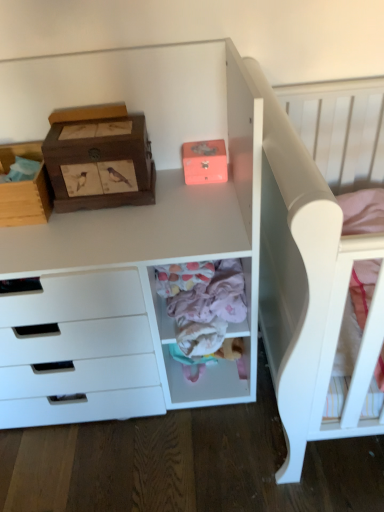
Question: Is wooden cardboard box at left not near pastel pink fabric at center?

Choices:
 (A) no
 (B) yes

Answer: (A)

Question: Could you tell me if wooden cardboard box at left is turned towards pastel pink fabric at center?

Choices:
 (A) no
 (B) yes

Answer: (A)

Question: Can you confirm if wooden cardboard box at left is smaller than pastel pink fabric at center?

Choices:
 (A) yes
 (B) no

Answer: (A)

Question: Is wooden cardboard box at left outside pastel pink fabric at center?

Choices:
 (A) yes
 (B) no

Answer: (A)

Question: From the image's perspective, is wooden cardboard box at left over pastel pink fabric at center?

Choices:
 (A) yes
 (B) no

Answer: (A)

Question: From a real-world perspective, is white matte wooden desk at upper left above or below matte pink shoe box at upper center, which is the second shoe box in left-to-right order?

Choices:
 (A) below
 (B) above

Answer: (A)

Question: Is white matte wooden desk at upper left wider or thinner than matte pink shoe box at upper center, the first shoe box when ordered from right to left?

Choices:
 (A) wide
 (B) thin

Answer: (A)

Question: Considering the relative positions of white matte wooden desk at upper left and matte pink shoe box at upper center, the first shoe box when ordered from right to left, in the image provided, is white matte wooden desk at upper left to the left or to the right of matte pink shoe box at upper center, the first shoe box when ordered from right to left,?

Choices:
 (A) left
 (B) right

Answer: (A)

Question: Is white matte wooden desk at upper left inside the boundaries of matte pink shoe box at upper center, the first shoe box when ordered from right to left, or outside?

Choices:
 (A) outside
 (B) inside

Answer: (A)

Question: From the image's perspective, is white matte bed at upper right located above or below pastel pink fabric at lower center?

Choices:
 (A) below
 (B) above

Answer: (B)

Question: From a real-world perspective, is white matte bed at upper right above or below pastel pink fabric at lower center?

Choices:
 (A) below
 (B) above

Answer: (B)

Question: Is white matte bed at upper right taller or shorter than pastel pink fabric at lower center?

Choices:
 (A) tall
 (B) short

Answer: (A)

Question: Which is correct: white matte bed at upper right is inside pastel pink fabric at lower center, or outside of it?

Choices:
 (A) inside
 (B) outside

Answer: (B)

Question: From a real-world perspective, relative to pastel pink fabric at center, is white matte wooden desk at upper left vertically above or below?

Choices:
 (A) below
 (B) above

Answer: (B)

Question: Would you say white matte wooden desk at upper left is to the left or to the right of pastel pink fabric at center in the picture?

Choices:
 (A) left
 (B) right

Answer: (A)